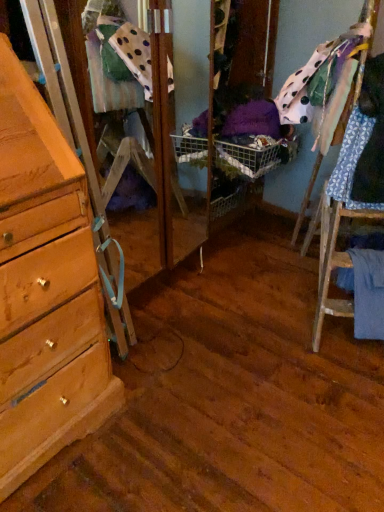
Question: Can you confirm if polka dot fabric at upper right, the 3th clothing ordered from the bottom, is smaller than blue patterned fabric at right, the second clothing from the top?

Choices:
 (A) yes
 (B) no

Answer: (B)

Question: Can you confirm if polka dot fabric at upper right, placed as the first clothing when sorted from top to bottom, is thinner than blue patterned fabric at right, the second clothing from the top?

Choices:
 (A) no
 (B) yes

Answer: (A)

Question: Is polka dot fabric at upper right, placed as the first clothing when sorted from top to bottom, located outside blue patterned fabric at right, which is the second clothing in bottom-to-top order?

Choices:
 (A) no
 (B) yes

Answer: (B)

Question: Is polka dot fabric at upper right, the 3th clothing ordered from the bottom, oriented away from blue patterned fabric at right, the second clothing from the top?

Choices:
 (A) yes
 (B) no

Answer: (B)

Question: Would you say polka dot fabric at upper right, the 3th clothing ordered from the bottom, is a long distance from blue patterned fabric at right, which is the second clothing in bottom-to-top order?

Choices:
 (A) yes
 (B) no

Answer: (B)

Question: Considering their positions, is blue fabric at lower right, which is counted as the first clothing, starting from the bottom, located in front of or behind polka dot fabric at upper right, placed as the first clothing when sorted from top to bottom?

Choices:
 (A) front
 (B) behind

Answer: (B)

Question: Is blue fabric at lower right, which is counted as the first clothing, starting from the bottom, bigger or smaller than polka dot fabric at upper right, placed as the first clothing when sorted from top to bottom?

Choices:
 (A) big
 (B) small

Answer: (B)

Question: From a real-world perspective, is blue fabric at lower right, which is counted as the first clothing, starting from the bottom, physically located above or below polka dot fabric at upper right, placed as the first clothing when sorted from top to bottom?

Choices:
 (A) above
 (B) below

Answer: (B)

Question: Is blue fabric at lower right, marked as the third clothing in a top-to-bottom arrangement, to the left or to the right of polka dot fabric at upper right, placed as the first clothing when sorted from top to bottom, in the image?

Choices:
 (A) right
 (B) left

Answer: (A)

Question: Relative to blue patterned fabric at right, which is the second clothing in bottom-to-top order, is blue fabric at lower right, which is counted as the first clothing, starting from the bottom, in front or behind?

Choices:
 (A) front
 (B) behind

Answer: (B)

Question: In terms of width, does blue fabric at lower right, marked as the third clothing in a top-to-bottom arrangement, look wider or thinner when compared to blue patterned fabric at right, the second clothing from the top?

Choices:
 (A) thin
 (B) wide

Answer: (B)

Question: Considering the relative positions of blue fabric at lower right, which is counted as the first clothing, starting from the bottom, and blue patterned fabric at right, the second clothing from the top, in the image provided, is blue fabric at lower right, which is counted as the first clothing, starting from the bottom, to the left or to the right of blue patterned fabric at right, the second clothing from the top,?

Choices:
 (A) left
 (B) right

Answer: (B)

Question: Is point (357, 296) closer or farther from the camera than point (360, 113)?

Choices:
 (A) closer
 (B) farther

Answer: (B)

Question: Is polka dot fabric at upper right, placed as the first clothing when sorted from top to bottom, wider or thinner than blue patterned fabric at right, which is the second clothing in bottom-to-top order?

Choices:
 (A) thin
 (B) wide

Answer: (B)

Question: Is polka dot fabric at upper right, the 3th clothing ordered from the bottom, bigger or smaller than blue patterned fabric at right, the second clothing from the top?

Choices:
 (A) small
 (B) big

Answer: (B)